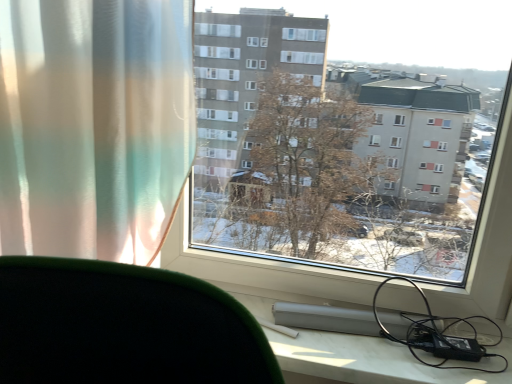
Question: From a real-world perspective, is translucent fabric curtain at left physically located above or below black rubber cable at lower right?

Choices:
 (A) below
 (B) above

Answer: (B)

Question: Considering the positions of point (125, 34) and point (451, 352), is point (125, 34) closer or farther from the camera than point (451, 352)?

Choices:
 (A) farther
 (B) closer

Answer: (B)

Question: Estimate the real-world distances between objects in this image. Which object is closer to the transparent glass window at center?

Choices:
 (A) black rubber cable at lower right
 (B) translucent fabric curtain at left

Answer: (A)

Question: Which object is the farthest from the translucent fabric curtain at left?

Choices:
 (A) black rubber cable at lower right
 (B) transparent glass window at center

Answer: (A)